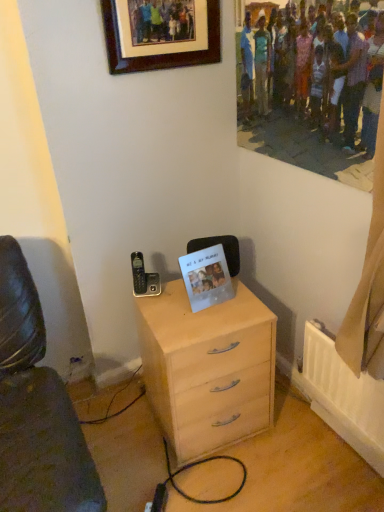
Question: From the image's perspective, relative to light wood chest of drawers at center, is transparent plastic photo frame at center above or below?

Choices:
 (A) below
 (B) above

Answer: (B)

Question: Is transparent plastic photo frame at center wider or thinner than light wood chest of drawers at center?

Choices:
 (A) thin
 (B) wide

Answer: (A)

Question: Estimate the real-world distances between objects in this image. Which object is closer to the brown wooden picture frame at upper center?

Choices:
 (A) transparent plastic photo frame at center
 (B) light wood chest of drawers at center

Answer: (A)

Question: Considering the real-world distances, which object is farthest from the transparent plastic photo frame at center?

Choices:
 (A) brown wooden picture frame at upper center
 (B) light wood chest of drawers at center

Answer: (A)